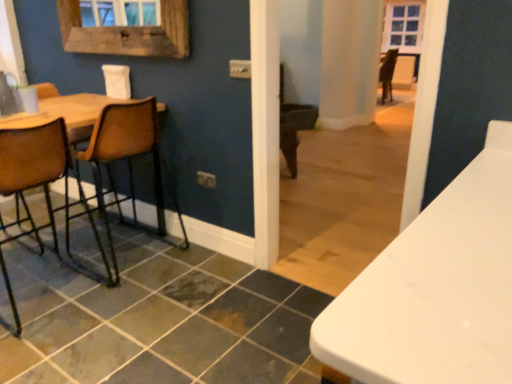
Question: From a real-world perspective, relative to slate tile at lower left, is wooden frame at upper left vertically above or below?

Choices:
 (A) below
 (B) above

Answer: (B)

Question: Based on their sizes in the image, would you say wooden frame at upper left is bigger or smaller than slate tile at lower left?

Choices:
 (A) small
 (B) big

Answer: (A)

Question: Estimate the real-world distances between objects in this image. Which object is farther from the slate tile at lower left?

Choices:
 (A) brown leather chair at left, which is counted as the 1th chair, starting from the right
 (B) wooden frame at upper left
 (C) wooden seat at left, marked as the 1th chair in a left-to-right arrangement

Answer: (B)

Question: Which is farther from the wooden seat at left, marked as the 1th chair in a left-to-right arrangement?

Choices:
 (A) wooden frame at upper left
 (B) slate tile at lower left
 (C) brown leather chair at left, which is the 2th chair from left to right

Answer: (A)